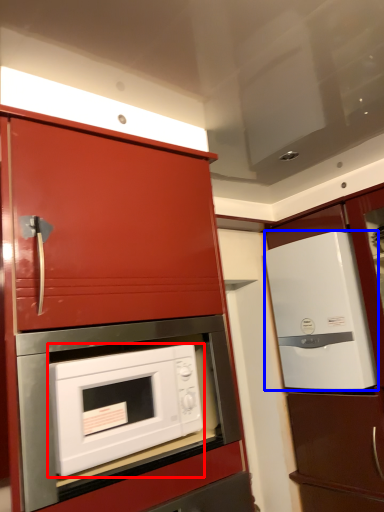
Question: Which point is further to the camera, microwave oven (highlighted by a red box) or refrigerator (highlighted by a blue box)?

Choices:
 (A) microwave oven
 (B) refrigerator

Answer: (B)